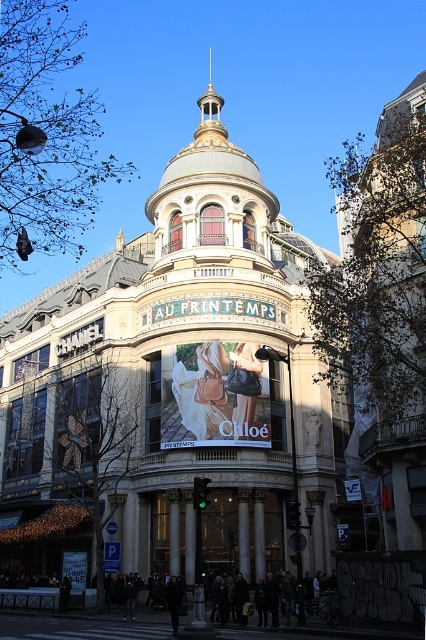
Who is positioned more to the left, gold metallic dome at center or leather handbag at center?

gold metallic dome at center

Who is more distant from viewer, (209, 157) or (207, 392)?

The point (209, 157) is more distant.

Who is more forward, (307, 480) or (210, 371)?

Positioned in front is point (210, 371).

This screenshot has width=426, height=640. In order to click on gold metallic dome at center in this screenshot , I will do `click(175, 385)`.

Can you confirm if leather handbag at center is positioned below white glossy signboard at center?

No.

Between leather handbag at center and white glossy signboard at center, which one is positioned higher?

Positioned higher is leather handbag at center.

Is point (192, 371) positioned before point (77, 564)?

Yes.

Identify the location of leather handbag at center. The image size is (426, 640). (215, 396).

Does gold metallic dome at center have a greater width compared to white glossy signboard at center?

Indeed, gold metallic dome at center has a greater width compared to white glossy signboard at center.

Is point (322, 264) positioned behind point (69, 573)?

Yes.

What are the coordinates of `gold metallic dome at center` in the screenshot? It's located at (175, 385).